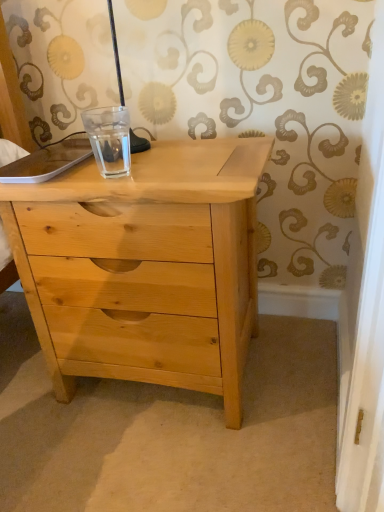
Question: Would you consider natural wood chest of drawers at center to be distant from clear glass cup at center?

Choices:
 (A) no
 (B) yes

Answer: (A)

Question: Is natural wood chest of drawers at center oriented towards clear glass cup at center?

Choices:
 (A) yes
 (B) no

Answer: (B)

Question: Does natural wood chest of drawers at center contain clear glass cup at center?

Choices:
 (A) yes
 (B) no

Answer: (B)

Question: Does natural wood chest of drawers at center appear on the right side of clear glass cup at center?

Choices:
 (A) yes
 (B) no

Answer: (A)

Question: Does natural wood chest of drawers at center come behind clear glass cup at center?

Choices:
 (A) yes
 (B) no

Answer: (B)

Question: From a real-world perspective, is natural wood chest of drawers at center physically above clear glass cup at center?

Choices:
 (A) no
 (B) yes

Answer: (A)

Question: Would you say clear glass cup at center is a long distance from natural wood chest of drawers at center?

Choices:
 (A) no
 (B) yes

Answer: (A)

Question: Could you tell me if clear glass cup at center is facing natural wood chest of drawers at center?

Choices:
 (A) yes
 (B) no

Answer: (B)

Question: From the image's perspective, would you say clear glass cup at center is shown under natural wood chest of drawers at center?

Choices:
 (A) no
 (B) yes

Answer: (A)

Question: Considering the relative positions of clear glass cup at center and natural wood chest of drawers at center in the image provided, is clear glass cup at center in front of natural wood chest of drawers at center?

Choices:
 (A) yes
 (B) no

Answer: (B)

Question: Does clear glass cup at center come behind natural wood chest of drawers at center?

Choices:
 (A) yes
 (B) no

Answer: (A)

Question: Is clear glass cup at center directly adjacent to natural wood chest of drawers at center?

Choices:
 (A) yes
 (B) no

Answer: (B)

Question: Considering the positions of natural wood chest of drawers at center and clear glass cup at center in the image, is natural wood chest of drawers at center taller or shorter than clear glass cup at center?

Choices:
 (A) short
 (B) tall

Answer: (B)